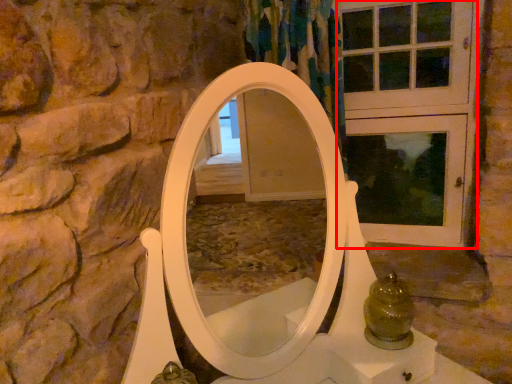
Question: From the image's perspective, considering the relative positions of screen door (annotated by the red box) and glass jar in the image provided, where is screen door (annotated by the red box) located with respect to the staircase?

Choices:
 (A) above
 (B) below

Answer: (A)